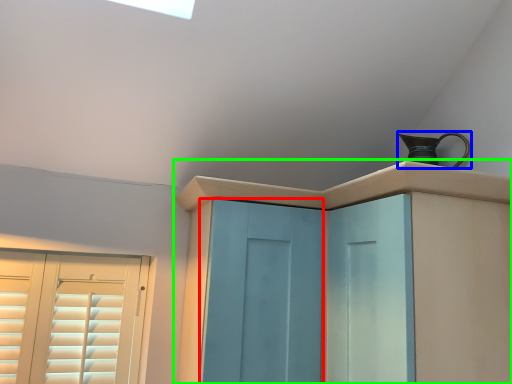
Question: Considering the real-world distances, which object is farthest from screen door (highlighted by a red box)? jug (highlighted by a blue box) or cupboard (highlighted by a green box)?

Choices:
 (A) jug
 (B) cupboard

Answer: (A)